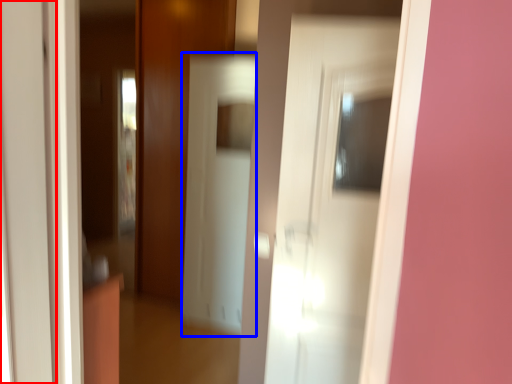
Question: Among these objects, which one is farthest to the camera, door (highlighted by a red box) or screen door (highlighted by a blue box)?

Choices:
 (A) door
 (B) screen door

Answer: (B)